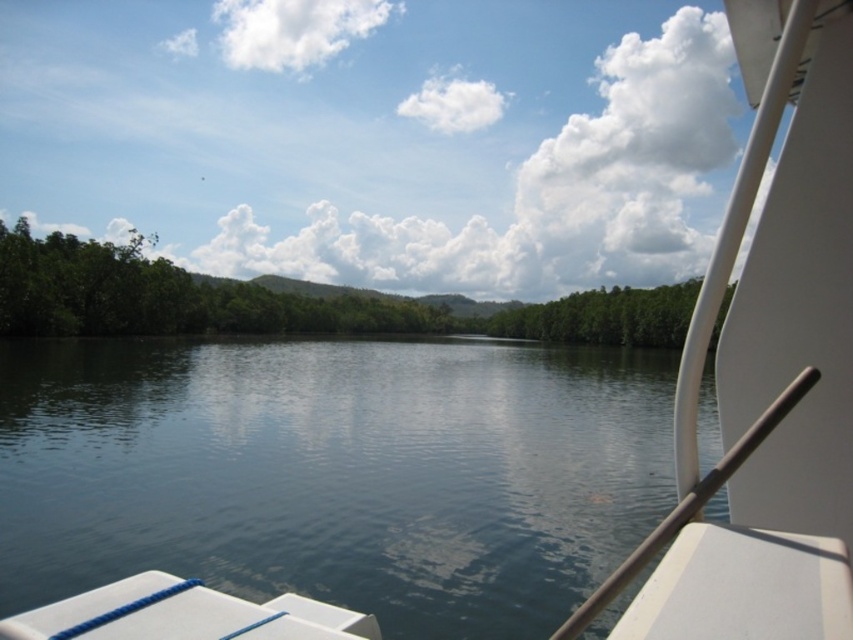
Is transparent water at center wider than white glossy boat at upper right?

Indeed, transparent water at center has a greater width compared to white glossy boat at upper right.

Does transparent water at center lie in front of white glossy boat at upper right?

That is False.

This screenshot has width=853, height=640. Find the location of `transparent water at center`. transparent water at center is located at coordinates (335, 472).

At what (x,y) coordinates should I click in order to perform the action: click on transparent water at center. Please return your answer as a coordinate pair (x, y). The height and width of the screenshot is (640, 853). Looking at the image, I should click on (335, 472).

Is transparent water at center shorter than green leafy trees at left?

Correct, transparent water at center is not as tall as green leafy trees at left.

Is transparent water at center taller than green leafy trees at left?

No.

Who is more distant from viewer, (231, 538) or (206, 296)?

The point (206, 296) is behind.

The height and width of the screenshot is (640, 853). Find the location of `transparent water at center`. transparent water at center is located at coordinates (335, 472).

Which of these two, white glossy boat at upper right or green leafy trees at left, stands taller?

green leafy trees at left is taller.

Where is `white glossy boat at upper right`? The width and height of the screenshot is (853, 640). white glossy boat at upper right is located at coordinates (769, 372).

Locate an element on the screen. This screenshot has height=640, width=853. white glossy boat at upper right is located at coordinates (769, 372).